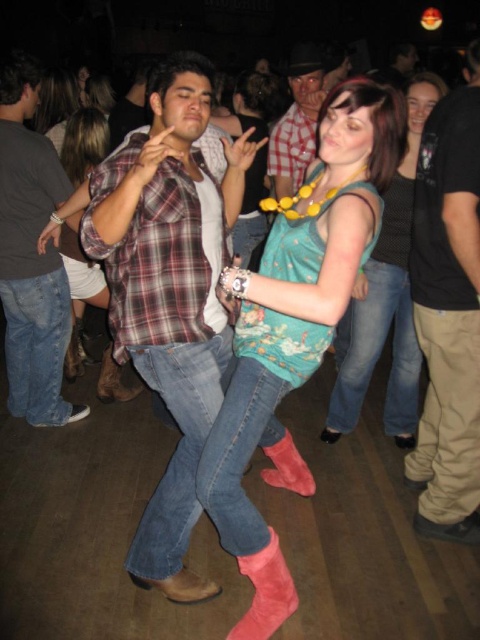
Question: Does black cotton shirt at right have a larger size compared to teal fabric tank top at center?

Choices:
 (A) no
 (B) yes

Answer: (A)

Question: Estimate the real-world distances between objects in this image. Which object is farther from the checkered fabric shirt at center?

Choices:
 (A) plaid shirt at center
 (B) teal jersey at center
 (C) suede boots at center
 (D) suede pink boot at lower center

Answer: (D)

Question: Which object appears closest to the camera in this image?

Choices:
 (A) teal fabric tank top at center
 (B) suede pink boot at lower center
 (C) plaid shirt at center
 (D) checkered fabric shirt at center

Answer: (C)

Question: Which point is closer to the camera taking this photo?

Choices:
 (A) (243, 563)
 (B) (263, 476)
 (C) (255, 227)
 (D) (261, 298)

Answer: (D)

Question: Can you confirm if teal fabric tank top at center is wider than suede pink boot at lower center?

Choices:
 (A) no
 (B) yes

Answer: (B)

Question: Is teal fabric tank top at center further to camera compared to suede pink boot at lower center?

Choices:
 (A) no
 (B) yes

Answer: (B)